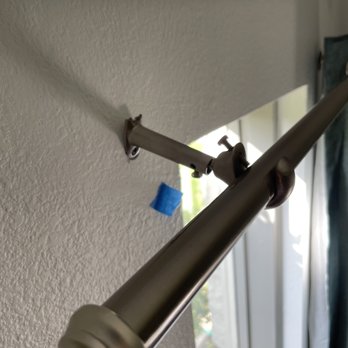
Where is `window`? window is located at coordinates (193, 194).